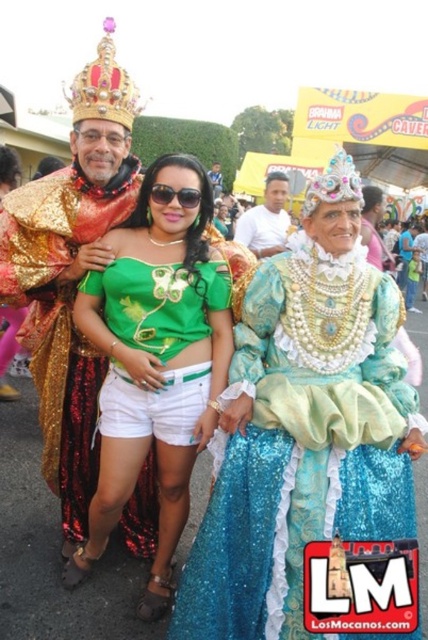
Can you confirm if green satin blouse at center is shorter than sunglasses at center?

In fact, green satin blouse at center may be taller than sunglasses at center.

Does green satin blouse at center appear on the right side of sunglasses at center?

No, green satin blouse at center is not to the right of sunglasses at center.

Who is more distant from viewer, (97, 337) or (175, 195)?

The point (175, 195) is behind.

Locate an element on the screen. The width and height of the screenshot is (428, 640). green satin blouse at center is located at coordinates (154, 362).

From the picture: Does green satin blouse at center appear on the left side of white cotton shirt at center?

Correct, you'll find green satin blouse at center to the left of white cotton shirt at center.

Does green satin blouse at center lie behind white cotton shirt at center?

No, green satin blouse at center is in front of white cotton shirt at center.

Where is `green satin blouse at center`? green satin blouse at center is located at coordinates (154, 362).

Is sequined gold robe at left smaller than sparkly silver crown at upper center?

Indeed, sequined gold robe at left has a smaller size compared to sparkly silver crown at upper center.

Which is in front, point (2, 259) or point (326, 182)?

Point (326, 182) is more forward.

Identify the location of sequined gold robe at left. The image size is (428, 640). (62, 317).

At what (x,y) coordinates should I click in order to perform the action: click on sequined gold robe at left. Please return your answer as a coordinate pair (x, y). Looking at the image, I should click on (62, 317).